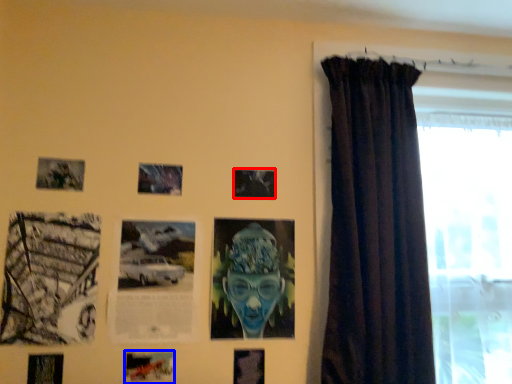
Question: Which object is further to the camera taking this photo, picture frame (highlighted by a red box) or picture frame (highlighted by a blue box)?

Choices:
 (A) picture frame
 (B) picture frame

Answer: (A)